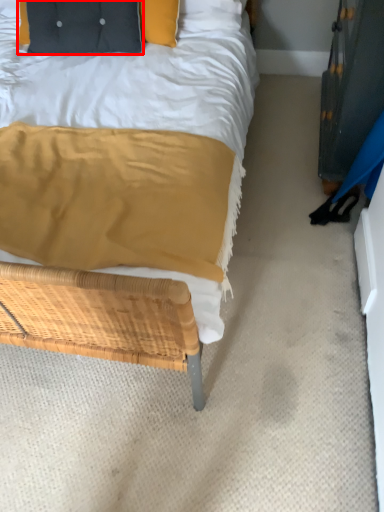
Question: Observing the image, what is the correct spatial positioning of pillow (annotated by the red box) in reference to dresser?

Choices:
 (A) left
 (B) right

Answer: (A)